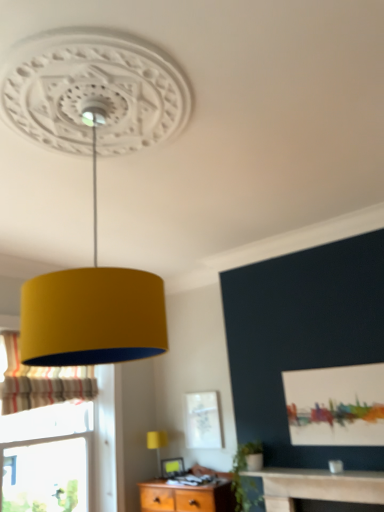
What do you see at coordinates (172, 467) in the screenshot? I see `matte white picture frame at lower center` at bounding box center [172, 467].

You are a GUI agent. You are given a task and a screenshot of the screen. Output one action in this format:
    pyautogui.click(x=<x>, y=<y>)
    Task: Click on the matte yellow lampshade at lower center
    Image resolution: width=384 pixels, height=512 pixels.
    Given the screenshot: What is the action you would take?
    pyautogui.click(x=157, y=445)

Describe the element at coordinates (157, 445) in the screenshot. This screenshot has height=512, width=384. I see `matte yellow lampshade at lower center` at that location.

You are a GUI agent. You are given a task and a screenshot of the screen. Output one action in this format:
    pyautogui.click(x=<x>, y=<y>)
    Task: Click on the striped fabric curtain at left
    The image size is (384, 512).
    Given the screenshot: What is the action you would take?
    pyautogui.click(x=41, y=382)

I want to click on matte white picture frame at lower center, so click(172, 467).

Is matte white picture frame at lower center aimed at striped fabric curtain at left?

No, matte white picture frame at lower center is not aimed at striped fabric curtain at left.

Considering the sizes of objects matte white picture frame at lower center and striped fabric curtain at left in the image provided, who is smaller, matte white picture frame at lower center or striped fabric curtain at left?

matte white picture frame at lower center is smaller.

Considering the relative sizes of matte white picture frame at lower center and striped fabric curtain at left in the image provided, is matte white picture frame at lower center taller than striped fabric curtain at left?

No.

Which object is wider, matte yellow lampshade at lower center or matte white picture frame at lower center?

matte yellow lampshade at lower center.

Considering the positions of objects matte yellow lampshade at lower center and matte white picture frame at lower center in the image provided, who is in front, matte yellow lampshade at lower center or matte white picture frame at lower center?

matte yellow lampshade at lower center is in front.

Which is more to the left, matte yellow lampshade at lower center or matte white picture frame at lower center?

From the viewer's perspective, matte yellow lampshade at lower center appears more on the left side.

From the image's perspective, between striped fabric curtain at left and matte white picture frame at lower center, which one is located above?

striped fabric curtain at left appears higher in the image.

Would you consider striped fabric curtain at left to be distant from matte white picture frame at lower center?

Yes.

Which object is positioned more to the right, striped fabric curtain at left or matte white picture frame at lower center?

Positioned to the right is matte white picture frame at lower center.

In the scene shown: Which of these two, striped fabric curtain at left or matte white picture frame at lower center, is bigger?

striped fabric curtain at left.

Does striped fabric curtain at left turn towards matte yellow lampshade at lower center?

No, striped fabric curtain at left is not facing towards matte yellow lampshade at lower center.

Identify the location of curtain above the matte yellow lampshade at lower center (from a real-world perspective). (41, 382).

From the image's perspective, between striped fabric curtain at left and matte yellow lampshade at lower center, which one is located above?

striped fabric curtain at left appears higher in the image.

Is matte white picture frame at lower center facing away from matte yellow lampshade at lower center?

Yes, matte yellow lampshade at lower center is at the back of matte white picture frame at lower center.

Who is taller, matte white picture frame at lower center or matte yellow lampshade at lower center?

With more height is matte yellow lampshade at lower center.

From a real-world perspective, which object stands above the other?

matte yellow lampshade at lower center is physically above.

Does matte yellow lampshade at lower center have a lesser height compared to striped fabric curtain at left?

Indeed, matte yellow lampshade at lower center has a lesser height compared to striped fabric curtain at left.

Is matte yellow lampshade at lower center beside striped fabric curtain at left?

There is a gap between matte yellow lampshade at lower center and striped fabric curtain at left.

From a real-world perspective, relative to striped fabric curtain at left, is matte yellow lampshade at lower center vertically above or below?

Clearly, from a real-world perspective, matte yellow lampshade at lower center is below striped fabric curtain at left.

Locate an element on the screen. The height and width of the screenshot is (512, 384). curtain on the left of matte white picture frame at lower center is located at coordinates (41, 382).

Identify the location of picture frame below the matte yellow lampshade at lower center (from a real-world perspective). (172, 467).

From the image, which object appears to be nearer to striped fabric curtain at left, matte yellow lampshade at lower center or matte white picture frame at lower center?

Among the two, matte yellow lampshade at lower center is located nearer to striped fabric curtain at left.

Based on their spatial positions, is matte white picture frame at lower center or striped fabric curtain at left further from matte yellow lampshade at lower center?

striped fabric curtain at left is positioned further to the anchor matte yellow lampshade at lower center.

Looking at the image, which one is located closer to matte white picture frame at lower center, striped fabric curtain at left or matte yellow lampshade at lower center?

matte yellow lampshade at lower center is closer to matte white picture frame at lower center.

When comparing their distances from matte white picture frame at lower center, does matte yellow lampshade at lower center or striped fabric curtain at left seem further?

striped fabric curtain at left lies further to matte white picture frame at lower center than the other object.

From the image, which object appears to be nearer to matte yellow lampshade at lower center, striped fabric curtain at left or matte white picture frame at lower center?

Based on the image, matte white picture frame at lower center appears to be nearer to matte yellow lampshade at lower center.

Looking at the image, which one is located closer to striped fabric curtain at left, matte white picture frame at lower center or matte yellow lampshade at lower center?

matte yellow lampshade at lower center is positioned closer to the anchor striped fabric curtain at left.

Identify the location of table lamp between striped fabric curtain at left and matte white picture frame at lower center in the horizontal direction. (157, 445).